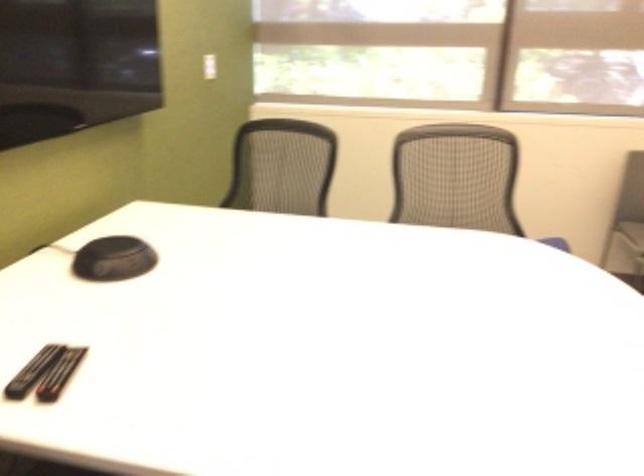
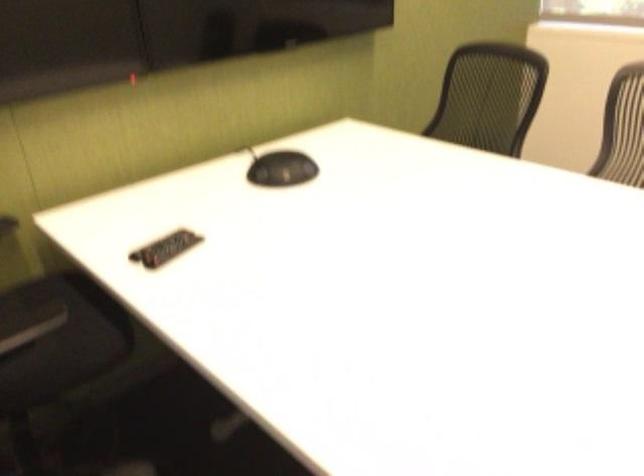
Question: The camera is either moving clockwise (left) or counter-clockwise (right) around the object. The first image is from the beginning of the video and the second image is from the end. Is the camera moving left or right when shooting the video?

Choices:
 (A) Left
 (B) Right

Answer: (B)